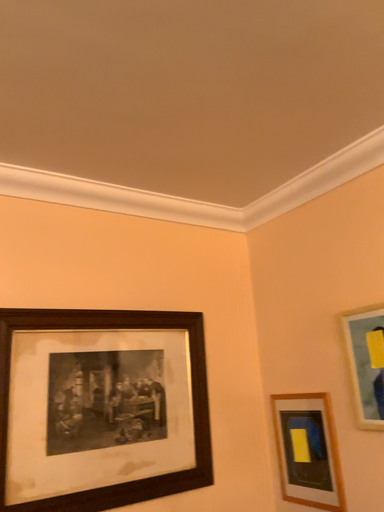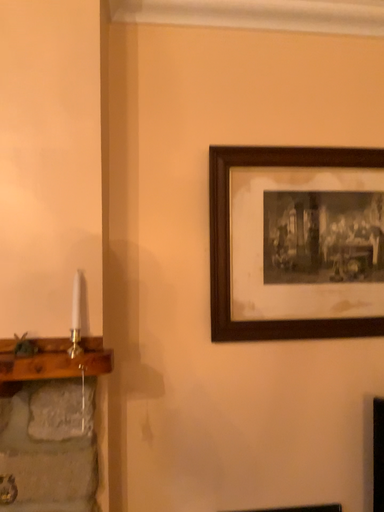
Question: How did the camera likely rotate when shooting the video?

Choices:
 (A) rotated downward
 (B) rotated upward

Answer: (A)